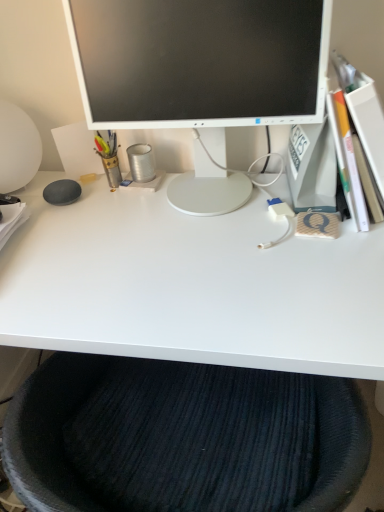
Locate an element on the screen. blank space to the left of metallic pen holder at left, which appears as the second stationery when viewed from the right is located at coordinates (44, 194).